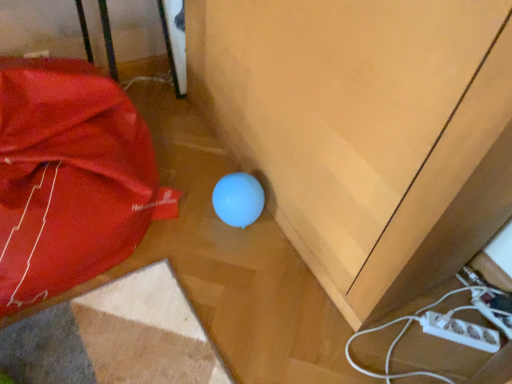
At what (x,y) coordinates should I click in order to perform the action: click on vacant area in front of matte wood cabinet at center. Please return your answer as a coordinate pair (x, y). Looking at the image, I should click on 244,317.